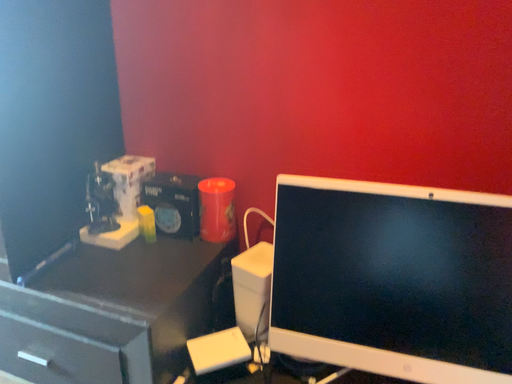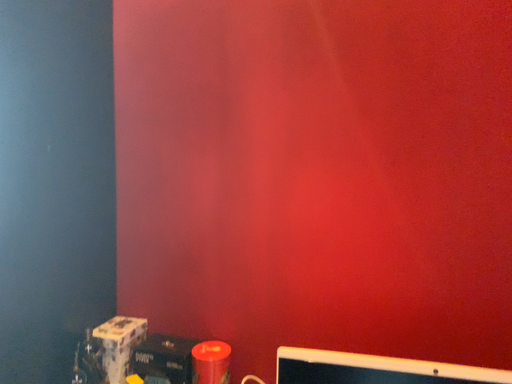
Question: Which way did the camera rotate in the video?

Choices:
 (A) rotated downward
 (B) rotated upward

Answer: (B)